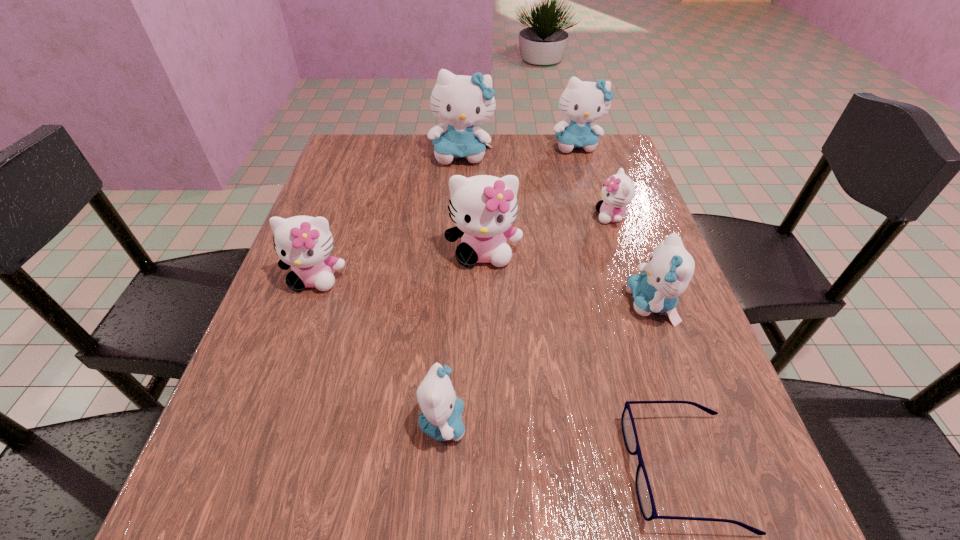
In order to click on object that is at the near right corner in this screenshot , I will do `click(644, 493)`.

Where is `vacant space at the near edge of the desktop`? Image resolution: width=960 pixels, height=540 pixels. vacant space at the near edge of the desktop is located at coordinates (381, 515).

Locate an element on the screen. Image resolution: width=960 pixels, height=540 pixels. free location at the left edge of the desktop is located at coordinates 293,425.

This screenshot has height=540, width=960. Find the location of `vacant space at the right edge of the desktop`. vacant space at the right edge of the desktop is located at coordinates (603, 291).

In the image, there is a desktop. Identify the location of vacant space at the near left corner. (225, 486).

Identify the location of vacant region at the far right corner. (592, 160).

The height and width of the screenshot is (540, 960). Find the location of `free space between the tallest object and the spectacles`. free space between the tallest object and the spectacles is located at coordinates (573, 313).

Where is `vacant point located between the tallest kitten and the fifth nearest kitten`? vacant point located between the tallest kitten and the fifth nearest kitten is located at coordinates (537, 186).

Where is `free space between the second biggest white kitten and the smallest blue kitten`? Image resolution: width=960 pixels, height=540 pixels. free space between the second biggest white kitten and the smallest blue kitten is located at coordinates (379, 350).

Find the location of a particular element. The width and height of the screenshot is (960, 540). vacant area that lies between the nearest kitten and the tallest kitten is located at coordinates (452, 289).